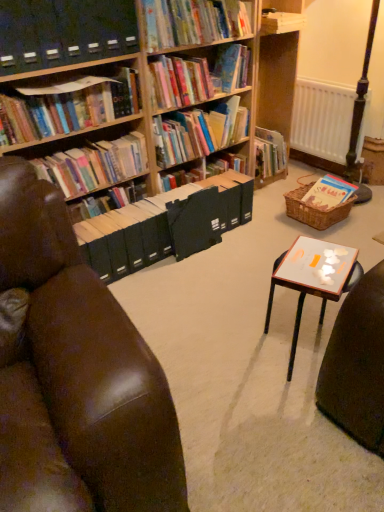
What is the approximate width of black matte folder at center?

black matte folder at center is 1.76 inches wide.

This screenshot has height=512, width=384. Describe the element at coordinates (75, 375) in the screenshot. I see `brown leather chair at left` at that location.

What do you see at coordinates (64, 32) in the screenshot?
I see `black plastic shelf at upper left` at bounding box center [64, 32].

Image resolution: width=384 pixels, height=512 pixels. In order to click on hardcover books at upper center, the fifth book viewed from the left in this screenshot , I will do `click(198, 132)`.

How much space does hardcover books at upper center, which ranks as the 2th book in right-to-left order, occupy vertically?

It is 11.33 inches.

What do you see at coordinates (313, 278) in the screenshot? I see `white glossy table at center` at bounding box center [313, 278].

What do you see at coordinates (329, 193) in the screenshot? I see `hardcover book at right, which is counted as the 1th book, starting from the right` at bounding box center [329, 193].

In order to face hardcover book at upper center, the 4th book positioned from the right, should I rotate leftwards or rightwards?

You should rotate right by 0.237 degrees.

Identify the location of hardcover book at upper center, acting as the third book starting from the left. (193, 22).

The image size is (384, 512). Describe the element at coordinates (322, 120) in the screenshot. I see `white matte radiator at right` at that location.

Locate an element on the screen. The height and width of the screenshot is (512, 384). black matte folder at center is located at coordinates (194, 222).

Which is behind, point (134, 14) or point (346, 267)?

The point (134, 14) is more distant.

This screenshot has width=384, height=512. In the image, there is a black plastic shelf at upper left. Find the location of `table below it (from the image's perspective)`. table below it (from the image's perspective) is located at coordinates (313, 278).

Could you tell me if black plastic shelf at upper left is facing white glossy table at center?

No, black plastic shelf at upper left is not aimed at white glossy table at center.

How far apart are black plastic shelf at upper left and white glossy table at center?

A distance of 4.46 feet exists between black plastic shelf at upper left and white glossy table at center.

In the scene shown: Which object is positioned more to the left, hardcover book at upper center, acting as the third book starting from the left, or white glossy table at center?

hardcover book at upper center, acting as the third book starting from the left.

Considering the relative sizes of hardcover book at upper center, the 4th book positioned from the right, and white glossy table at center in the image provided, is hardcover book at upper center, the 4th book positioned from the right, smaller than white glossy table at center?

Correct, hardcover book at upper center, the 4th book positioned from the right, occupies less space than white glossy table at center.

Which is closer, (156, 28) or (314, 295)?

Positioned in front is point (314, 295).

Does hardcover book at upper center, the 4th book positioned from the right, have a greater width compared to white glossy table at center?

Incorrect, the width of hardcover book at upper center, the 4th book positioned from the right, does not surpass that of white glossy table at center.

Is hardcover book at right, which is counted as the 1th book, starting from the right, positioned before black matte folder at center?

No, the depth of hardcover book at right, which is counted as the 1th book, starting from the right, is greater than that of black matte folder at center.

Considering the relative sizes of hardcover book at right, which is counted as the 1th book, starting from the right, and black matte folder at center in the image provided, is hardcover book at right, which is counted as the 1th book, starting from the right, wider than black matte folder at center?

Yes.

Which is less distant, (343, 194) or (214, 240)?

Point (343, 194) appears to be farther away from the viewer than point (214, 240).

Is hardcover book at right, which is counted as the 1th book, starting from the right, not close to black matte folder at center?

hardcover book at right, which is counted as the 1th book, starting from the right, is near black matte folder at center, not far away.

Would you say white matte radiator at right is to the left or to the right of brown leather chair at left in the picture?

In the image, white matte radiator at right appears on the right side of brown leather chair at left.

From a real-world perspective, is white matte radiator at right beneath brown leather chair at left?

Indeed, from a real-world perspective, white matte radiator at right is positioned beneath brown leather chair at left.

Is white matte radiator at right far from brown leather chair at left?

Yes, white matte radiator at right is far from brown leather chair at left.

Is brown leather chair at left at the back of white matte radiator at right?

No, white matte radiator at right is not facing away from brown leather chair at left.

Considering the positions of objects hardcover book at upper center, the 4th book positioned from the right, and hardcover books at upper center, the fifth book viewed from the left, in the image provided, who is behind, hardcover book at upper center, the 4th book positioned from the right, or hardcover books at upper center, the fifth book viewed from the left,?

hardcover books at upper center, the fifth book viewed from the left, is further from the camera.

Considering the relative sizes of hardcover book at upper center, acting as the third book starting from the left, and hardcover books at upper center, which ranks as the 2th book in right-to-left order, in the image provided, is hardcover book at upper center, acting as the third book starting from the left, smaller than hardcover books at upper center, which ranks as the 2th book in right-to-left order,?

Indeed, hardcover book at upper center, acting as the third book starting from the left, has a smaller size compared to hardcover books at upper center, which ranks as the 2th book in right-to-left order.

Who is taller, hardcover book at upper center, acting as the third book starting from the left, or hardcover books at upper center, the fifth book viewed from the left?

With more height is hardcover books at upper center, the fifth book viewed from the left.

In the scene shown: Is hardcover book at upper center, the 4th book positioned from the right, facing away from hardcover books at upper center, which ranks as the 2th book in right-to-left order?

No, hardcover book at upper center, the 4th book positioned from the right, is not facing the opposite direction of hardcover books at upper center, which ranks as the 2th book in right-to-left order.

Can you tell me how much brown leather chair at left and black matte folder at center differ in facing direction?

brown leather chair at left and black matte folder at center are facing 6.01 degrees away from each other.

Considering the sizes of brown leather chair at left and black matte folder at center in the image, is brown leather chair at left bigger or smaller than black matte folder at center?

Clearly, brown leather chair at left is larger in size than black matte folder at center.

Does brown leather chair at left turn towards black matte folder at center?

No, brown leather chair at left is not oriented towards black matte folder at center.

Which of these two, brown leather chair at left or black matte folder at center, stands taller?

brown leather chair at left.

Considering the points (317, 266) and (204, 125), which point is in front, point (317, 266) or point (204, 125)?

The point (317, 266) is more forward.

Which object is further away from the camera taking this photo, white glossy table at center or hardcover books at upper center, the fifth book viewed from the left?

hardcover books at upper center, the fifth book viewed from the left.

From the image's perspective, is white glossy table at center over hardcover books at upper center, the fifth book viewed from the left?

No, from the image's perspective, white glossy table at center is not on top of hardcover books at upper center, the fifth book viewed from the left.

Is the surface of white glossy table at center in direct contact with hardcover books at upper center, the fifth book viewed from the left?

There is a gap between white glossy table at center and hardcover books at upper center, the fifth book viewed from the left.

What are the coordinates of `table below the black plastic shelf at upper left (from a real-world perspective)` in the screenshot? It's located at (313, 278).

The height and width of the screenshot is (512, 384). I want to click on table below the hardcover book at upper center, the 4th book positioned from the right (from the image's perspective), so click(313, 278).

Which object lies nearer to the anchor point white matte radiator at right, brown leather chair at left or black matte folder at center?

black matte folder at center is positioned closer to the anchor white matte radiator at right.

Considering their positions, is hardcover books at left, arranged as the 5th book when viewed from the right, positioned closer to woven brown basket at right than black matte folder at center?

black matte folder at center is closer to woven brown basket at right.

In the scene shown: When comparing their distances from black matte folder at center, does white matte radiator at right or woven brown basket at right seem further?

Among the two, white matte radiator at right is located further to black matte folder at center.

From the image, which object appears to be nearer to hardcover books at upper center, which ranks as the 2th book in right-to-left order, hardcover books at left, arranged as the 5th book when viewed from the right, or black plastic shelf at upper left?

Among the two, hardcover books at left, arranged as the 5th book when viewed from the right, is located nearer to hardcover books at upper center, which ranks as the 2th book in right-to-left order.

From the image, which object appears to be nearer to black plastic shelf at upper left, brown leather chair at left or hardcover book at right, which is counted as the 1th book, starting from the right?

brown leather chair at left is positioned closer to the anchor black plastic shelf at upper left.

Looking at the image, which one is located closer to black plastic shelf at upper left, woven brown basket at right or hardcover books at upper center, which ranks as the 2th book in right-to-left order?

hardcover books at upper center, which ranks as the 2th book in right-to-left order, is positioned closer to the anchor black plastic shelf at upper left.

From the image, which object appears to be nearer to hardcover book at upper center, which is the 4th book in left-to-right order, black plastic shelf at upper left or white glossy table at center?

Among the two, black plastic shelf at upper left is located nearer to hardcover book at upper center, which is the 4th book in left-to-right order.

When comparing their distances from black plastic shelf at upper left, does hardcover books at upper center, the fifth book viewed from the left, or woven brown basket at right seem closer?

hardcover books at upper center, the fifth book viewed from the left, is positioned closer to the anchor black plastic shelf at upper left.

Locate an element on the screen. The height and width of the screenshot is (512, 384). shelf between hardcover book at upper left, which is counted as the 1th book, starting from the left, and hardcover books at upper center, which ranks as the 2th book in right-to-left order, from left to right is located at coordinates (64, 32).

Identify the location of paperback book that lies between hardcover book at upper center, the 4th book positioned from the right, and white glossy table at center from top to bottom. (194, 222).

The height and width of the screenshot is (512, 384). Find the location of `paperback book between brown leather chair at left and white matte radiator at right from front to back`. paperback book between brown leather chair at left and white matte radiator at right from front to back is located at coordinates (194, 222).

Locate an element on the screen. The width and height of the screenshot is (384, 512). book located between hardcover books at upper center, which ranks as the 2th book in right-to-left order, and white matte radiator at right in the left-right direction is located at coordinates (329, 193).